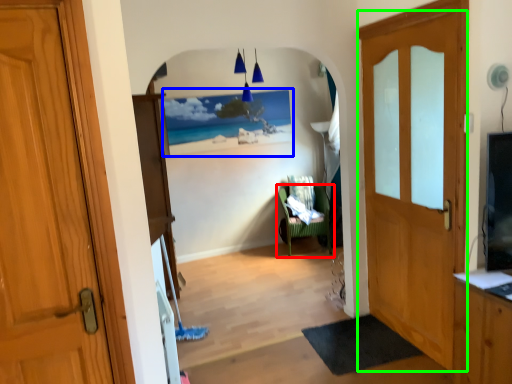
Question: Estimate the real-world distances between objects in this image. Which object is closer to chair (highlighted by a red box), picture frame (highlighted by a blue box) or door (highlighted by a green box)?

Choices:
 (A) picture frame
 (B) door

Answer: (A)